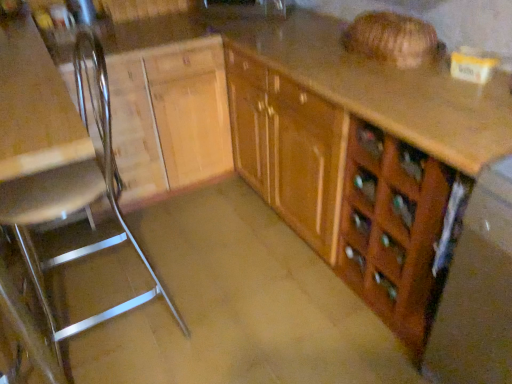
Find the location of a particular element. Image resolution: width=512 pixels, height=384 pixels. wooden drawer at lower right is located at coordinates (477, 291).

Image resolution: width=512 pixels, height=384 pixels. What do you see at coordinates (245, 9) in the screenshot?
I see `matte black sink at upper center` at bounding box center [245, 9].

What do you see at coordinates (54, 153) in the screenshot? The width and height of the screenshot is (512, 384). I see `metallic silver chair at left` at bounding box center [54, 153].

What are the coordinates of `metallic silver chair at left` in the screenshot? It's located at (54, 153).

What do you see at coordinates (238, 306) in the screenshot? The image size is (512, 384). I see `brown matte concrete at center` at bounding box center [238, 306].

Locate an element on the screen. This screenshot has width=512, height=384. wooden drawer at lower right is located at coordinates (477, 291).

From the image's perspective, is metallic silver chair at left located above wooden drawer at lower right?

Correct, metallic silver chair at left appears higher than wooden drawer at lower right in the image.

Between metallic silver chair at left and wooden drawer at lower right, which one is positioned behind?

Positioned behind is metallic silver chair at left.

Which of these two, metallic silver chair at left or wooden drawer at lower right, stands taller?

metallic silver chair at left.

Would you say metallic silver chair at left is a long distance from matte black sink at upper center?

Yes, metallic silver chair at left is far from matte black sink at upper center.

Which object is thinner, metallic silver chair at left or matte black sink at upper center?

Thinner between the two is matte black sink at upper center.

From a real-world perspective, relative to matte black sink at upper center, is metallic silver chair at left vertically above or below?

In terms of real-world spatial position, metallic silver chair at left is below matte black sink at upper center.

How much distance is there between wooden drawer at lower right and wooden cabinet at center?

wooden drawer at lower right is 16.83 inches away from wooden cabinet at center.

Can you see wooden drawer at lower right touching wooden cabinet at center?

wooden drawer at lower right and wooden cabinet at center are not in contact.

From the picture: From the image's perspective, which object appears higher, wooden drawer at lower right or wooden cabinet at center?

wooden cabinet at center.

Between wooden drawer at lower right and wooden cabinet at center, which one has smaller size?

wooden drawer at lower right.

Is wooden drawer at lower right not within metallic silver chair at left?

Yes, wooden drawer at lower right is located beyond the bounds of metallic silver chair at left.

From a real-world perspective, is wooden drawer at lower right physically located above or below metallic silver chair at left?

wooden drawer at lower right is situated lower than metallic silver chair at left in the real world.

What are the coordinates of `chair to the left of wooden drawer at lower right` in the screenshot? It's located at (54, 153).

Considering the relative sizes of wooden drawer at lower right and metallic silver chair at left in the image provided, is wooden drawer at lower right thinner than metallic silver chair at left?

Incorrect, the width of wooden drawer at lower right is not less than that of metallic silver chair at left.

Is matte black sink at upper center wider or thinner than wooden cabinet at center?

In the image, matte black sink at upper center appears to be more narrow than wooden cabinet at center.

Can you confirm if matte black sink at upper center is positioned to the right of wooden cabinet at center?

No, matte black sink at upper center is not to the right of wooden cabinet at center.

Is wooden cabinet at center at the back of matte black sink at upper center?

That's not correct — matte black sink at upper center is not looking away from wooden cabinet at center.

You are a GUI agent. You are given a task and a screenshot of the screen. Output one action in this format:
    pyautogui.click(x=<x>, y=<y>)
    Task: Click on the cabinetry that appears on the right of matte black sink at upper center
    The width and height of the screenshot is (512, 384).
    Given the screenshot: What is the action you would take?
    pyautogui.click(x=346, y=193)

From a real-world perspective, between matte black sink at upper center and metallic silver chair at left, who is vertically lower?

In real-world perspective, metallic silver chair at left is lower.

From the image's perspective, which one is positioned higher, matte black sink at upper center or metallic silver chair at left?

matte black sink at upper center.

Is matte black sink at upper center positioned with its back to metallic silver chair at left?

matte black sink at upper center does not have its back to metallic silver chair at left.

Looking at this image, does matte black sink at upper center have a greater height compared to metallic silver chair at left?

No.

Is brown matte concrete at center oriented towards wooden drawer at lower right?

No, brown matte concrete at center is not aimed at wooden drawer at lower right.

Which of these two, brown matte concrete at center or wooden drawer at lower right, is bigger?

brown matte concrete at center is bigger.

Which is correct: brown matte concrete at center is inside wooden drawer at lower right, or outside of it?

brown matte concrete at center is located beyond the bounds of wooden drawer at lower right.

Are brown matte concrete at center and wooden drawer at lower right making contact?

No.

The width and height of the screenshot is (512, 384). I want to click on appliance directly beneath the metallic silver chair at left (from a real-world perspective), so (x=477, y=291).

Image resolution: width=512 pixels, height=384 pixels. Identify the location of chair located in front of the matte black sink at upper center. (54, 153).

From the picture: Estimate the real-world distances between objects in this image. Which object is closer to matte black sink at upper center, wooden drawer at lower right or wooden cabinet at center?

Based on the image, wooden cabinet at center appears to be nearer to matte black sink at upper center.

From the image, which object appears to be nearer to metallic silver chair at left, brown matte concrete at center or wooden drawer at lower right?

brown matte concrete at center.

When comparing their distances from matte black sink at upper center, does metallic silver chair at left or brown matte concrete at center seem further?

The object further to matte black sink at upper center is brown matte concrete at center.

Estimate the real-world distances between objects in this image. Which object is further from metallic silver chair at left, matte black sink at upper center or wooden cabinet at center?

matte black sink at upper center is further to metallic silver chair at left.

Based on their spatial positions, is metallic silver chair at left or matte black sink at upper center closer to wooden drawer at lower right?

metallic silver chair at left.

When comparing their distances from matte black sink at upper center, does wooden drawer at lower right or metallic silver chair at left seem further?

The object further to matte black sink at upper center is wooden drawer at lower right.

Estimate the real-world distances between objects in this image. Which object is closer to matte black sink at upper center, metallic silver chair at left or wooden drawer at lower right?

metallic silver chair at left is positioned closer to the anchor matte black sink at upper center.

When comparing their distances from metallic silver chair at left, does wooden cabinet at center or wooden drawer at lower right seem closer?

wooden cabinet at center is positioned closer to the anchor metallic silver chair at left.

The height and width of the screenshot is (384, 512). I want to click on cabinetry between metallic silver chair at left and wooden drawer at lower right from left to right, so click(x=346, y=193).

This screenshot has height=384, width=512. In order to click on appliance between matte black sink at upper center and brown matte concrete at center from top to bottom in this screenshot , I will do pyautogui.click(x=477, y=291).

Find the location of `chair between wooden drawer at lower right and matte black sink at upper center along the z-axis`. chair between wooden drawer at lower right and matte black sink at upper center along the z-axis is located at coordinates (54, 153).

Identify the location of chair between matte black sink at upper center and brown matte concrete at center from top to bottom. This screenshot has width=512, height=384. (54, 153).